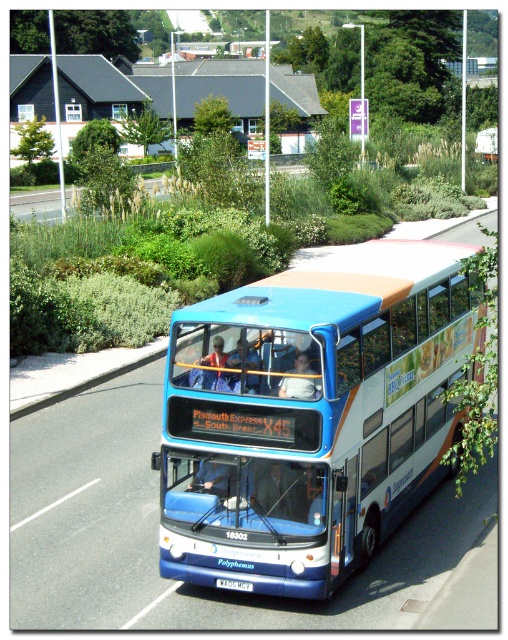
You are a pedestrian standing at the edge of the road. You see the blue metallic bus at center and the white plastic license plate at center. How far apart are these two objects from each other?

The blue metallic bus at center is 4.82 feet away from the white plastic license plate at center.

You are a delivery person who needs to load a package onto the roof of the blue metallic bus at center. The package is 1.2 meters tall. Considering the height of the white plastic license plate at center, will the package fit without exceeding the height limit?

The blue metallic bus at center is taller than the white plastic license plate at center. However, the exact height difference isn not specified. Therefore, it is uncertain whether the package will fit without exceeding the height limit.

From the picture: You are a photographer planning to take a photo of the blue metallic bus at center and the white plastic license plate at center. Based on their sizes in the image, which object would appear smaller in the photo?

The blue metallic bus at center has a lesser width compared to the white plastic license plate at center, so it would appear smaller in the photo.